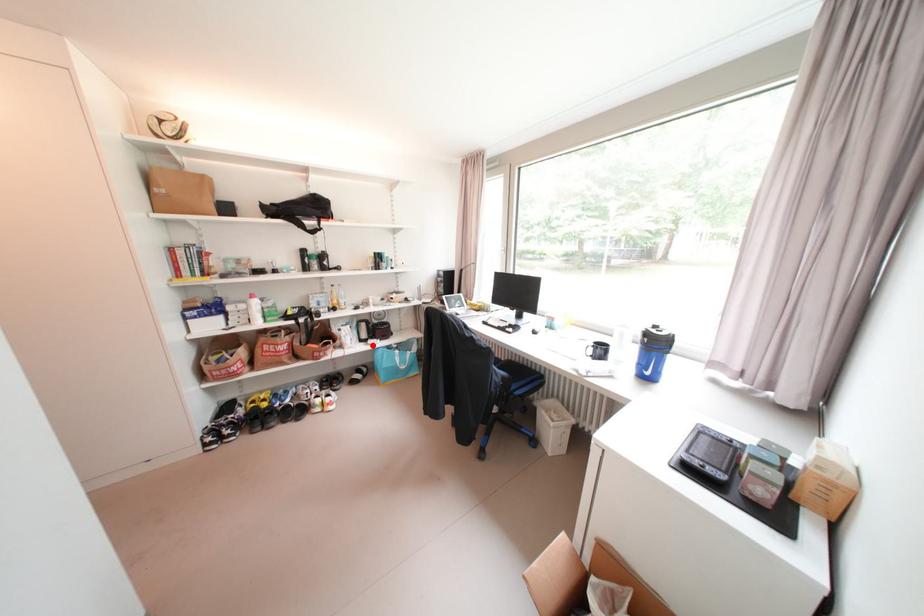
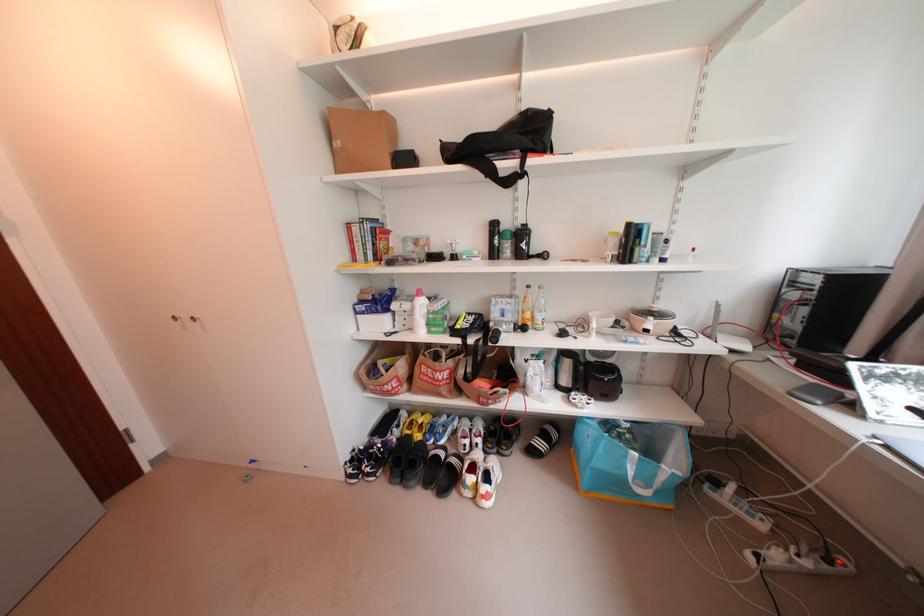
Question: I am providing you with two images of the same scene from different viewpoints. A red point is marked on the first image. Is the red point's position out of view in image 2?

Choices:
 (A) Yes
 (B) No

Answer: (B)